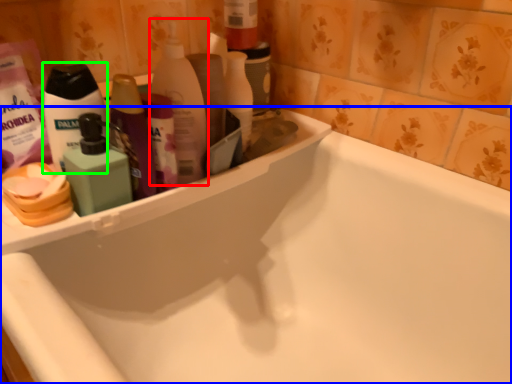
Question: Which object is the farthest from cleaning product (highlighted by a red box)? Choose among these: bathtub (highlighted by a blue box) or toiletry (highlighted by a green box).

Choices:
 (A) bathtub
 (B) toiletry

Answer: (A)